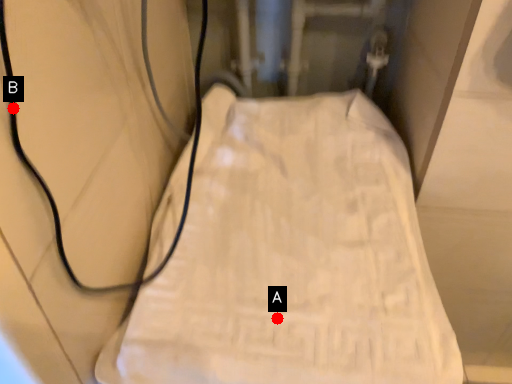
Question: Two points are circled on the image, labeled by A and B beside each circle. Among these points, which one is farthest from the camera?

Choices:
 (A) A is further
 (B) B is further

Answer: (A)